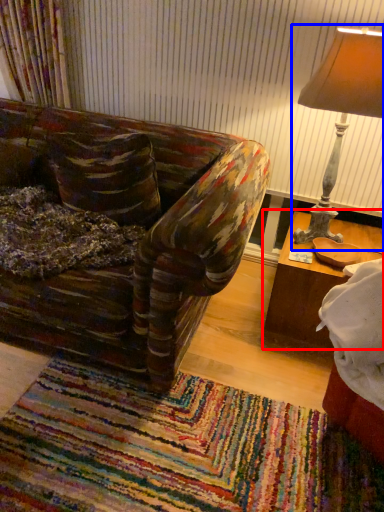
Question: Among these objects, which one is nearest to the camera, table (highlighted by a red box) or lamp (highlighted by a blue box)?

Choices:
 (A) table
 (B) lamp

Answer: (B)